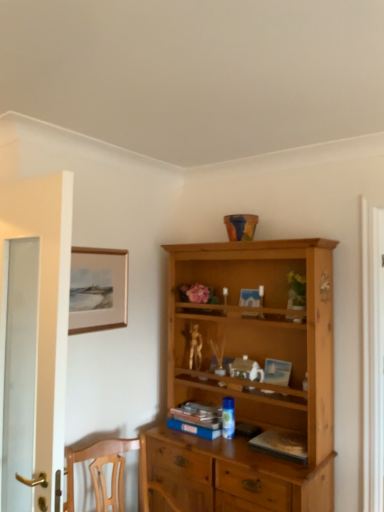
At what (x,y) coordinates should I click in order to perform the action: click on blue matte book at center, the first book positioned from the back. Please return your answer as a coordinate pair (x, y). The image size is (384, 512). Looking at the image, I should click on (196, 419).

Locate an element on the screen. matte gold picture frame at upper left is located at coordinates (100, 290).

At what (x,y) coordinates should I click in order to perform the action: click on white glass door at left. Please return your answer as a coordinate pair (x, y). The height and width of the screenshot is (512, 384). Looking at the image, I should click on (43, 306).

Is the depth of matte gold picture frame at upper left greater than that of gold metallic figurine at center?

That is False.

Consider the image. How far apart are matte gold picture frame at upper left and gold metallic figurine at center?

A distance of 63.82 centimeters exists between matte gold picture frame at upper left and gold metallic figurine at center.

Is matte gold picture frame at upper left at the right side of gold metallic figurine at center?

Incorrect, matte gold picture frame at upper left is not on the right side of gold metallic figurine at center.

From the picture: From the image's perspective, is matte gold picture frame at upper left located above or below gold metallic figurine at center?

From the image's perspective, matte gold picture frame at upper left appears above gold metallic figurine at center.

Which is in front, matte gold picture frame at upper left or white glass door at left?

white glass door at left.

Can you confirm if matte gold picture frame at upper left is shorter than white glass door at left?

Result: Yes.

Is matte gold picture frame at upper left wider or thinner than white glass door at left?

Clearly, matte gold picture frame at upper left has less width compared to white glass door at left.

From the image's perspective, which is below, matte gold picture frame at upper left or white glass door at left?

white glass door at left is shown below in the image.

In the image, is blue matte book at center, acting as the first book starting from the left, on the left side or the right side of hardcover book at center, the second book from the back?

blue matte book at center, acting as the first book starting from the left, is positioned on hardcover book at center, the second book from the back,'s left side.

From their relative heights in the image, would you say blue matte book at center, the first book positioned from the back, is taller or shorter than hardcover book at center, acting as the first book starting from the right?

blue matte book at center, the first book positioned from the back, is taller than hardcover book at center, acting as the first book starting from the right.

Can you see blue matte book at center, the first book positioned from the back, touching hardcover book at center, which is the 2th book from left to right?

No, blue matte book at center, the first book positioned from the back, is not in contact with hardcover book at center, which is the 2th book from left to right.

Can you tell me how much blue matte book at center, acting as the first book starting from the left, and hardcover book at center, the 1th book positioned from the front, differ in facing direction?

The angle between the facing direction of blue matte book at center, acting as the first book starting from the left, and the facing direction of hardcover book at center, the 1th book positioned from the front, is 8.95e-05 degrees.

Is white glass door at left positioned beyond the bounds of gold metallic figurine at center?

That's correct, white glass door at left is outside of gold metallic figurine at center.

Is white glass door at left at the left side of gold metallic figurine at center?

Yes, white glass door at left is to the left of gold metallic figurine at center.

Is white glass door at left wider than gold metallic figurine at center?

Yes, white glass door at left is wider than gold metallic figurine at center.

Based on the photo, is matte gold picture frame at upper left positioned with its back to blue matte book at center, acting as the first book starting from the left?

Result: matte gold picture frame at upper left does not have its back to blue matte book at center, acting as the first book starting from the left.

Does matte gold picture frame at upper left have a smaller size compared to blue matte book at center, the first book positioned from the back?

Yes.

Is matte gold picture frame at upper left to the right of blue matte book at center, acting as the second book starting from the right, from the viewer's perspective?

In fact, matte gold picture frame at upper left is to the left of blue matte book at center, acting as the second book starting from the right.

Considering the sizes of gold metallic figurine at center and white glass door at left in the image, is gold metallic figurine at center taller or shorter than white glass door at left?

In the image, gold metallic figurine at center appears to be shorter than white glass door at left.

Would you say gold metallic figurine at center is outside white glass door at left?

That's correct, gold metallic figurine at center is outside of white glass door at left.

From the image's perspective, which object appears higher, gold metallic figurine at center or white glass door at left?

white glass door at left.

Is gold metallic figurine at center far away from white glass door at left?

Indeed, gold metallic figurine at center is not near white glass door at left.

From the image's perspective, which object appears higher, white glass door at left or hardcover book at center, the 1th book positioned from the front?

white glass door at left is shown above in the image.

Is white glass door at left far from hardcover book at center, acting as the first book starting from the right?

Yes, white glass door at left and hardcover book at center, acting as the first book starting from the right, are located far from each other.

Between white glass door at left and hardcover book at center, which is the 2th book from left to right, which one is positioned behind?

Positioned behind is hardcover book at center, which is the 2th book from left to right.

Is white glass door at left not inside hardcover book at center, which is the 2th book from left to right?

Absolutely, white glass door at left is external to hardcover book at center, which is the 2th book from left to right.

Image resolution: width=384 pixels, height=512 pixels. I want to click on picture frame located above the gold metallic figurine at center (from the image's perspective), so click(x=100, y=290).

The width and height of the screenshot is (384, 512). I want to click on door that is on the left side of matte gold picture frame at upper left, so click(x=43, y=306).

Considering their positions, is hardcover book at center, the 1th book positioned from the front, positioned further to matte gold picture frame at upper left than white glass door at left?

hardcover book at center, the 1th book positioned from the front, is positioned further to the anchor matte gold picture frame at upper left.

When comparing their distances from gold metallic figurine at center, does blue matte book at center, acting as the first book starting from the left, or matte gold picture frame at upper left seem further?

matte gold picture frame at upper left is positioned further to the anchor gold metallic figurine at center.

When comparing their distances from blue matte book at center, acting as the second book starting from the right, does hardcover book at center, the second book from the back, or matte gold picture frame at upper left seem closer?

hardcover book at center, the second book from the back, is closer to blue matte book at center, acting as the second book starting from the right.

Estimate the real-world distances between objects in this image. Which object is closer to gold metallic figurine at center, hardcover book at center, which is the 2th book from left to right, or blue matte book at center, the first book positioned from the back?

Based on the image, blue matte book at center, the first book positioned from the back, appears to be nearer to gold metallic figurine at center.

Based on the photo, estimate the real-world distances between objects in this image. Which object is closer to gold metallic figurine at center, matte gold picture frame at upper left or white glass door at left?

matte gold picture frame at upper left is closer to gold metallic figurine at center.

When comparing their distances from matte gold picture frame at upper left, does gold metallic figurine at center or hardcover book at center, the second book from the back, seem closer?

gold metallic figurine at center lies closer to matte gold picture frame at upper left than the other object.

Which object lies further to the anchor point hardcover book at center, the 1th book positioned from the front, blue matte book at center, acting as the second book starting from the right, or white glass door at left?

white glass door at left is further to hardcover book at center, the 1th book positioned from the front.

From the image, which object appears to be nearer to blue matte book at center, the first book positioned from the back, gold metallic figurine at center or matte gold picture frame at upper left?

gold metallic figurine at center is closer to blue matte book at center, the first book positioned from the back.

At what (x,y) coordinates should I click in order to perform the action: click on toy that lies between matte gold picture frame at upper left and blue matte book at center, acting as the first book starting from the left, from top to bottom. Please return your answer as a coordinate pair (x, y). Looking at the image, I should click on (195, 348).

At what (x,y) coordinates should I click in order to perform the action: click on book situated between matte gold picture frame at upper left and hardcover book at center, acting as the first book starting from the right, from left to right. Please return your answer as a coordinate pair (x, y). The width and height of the screenshot is (384, 512). Looking at the image, I should click on (196, 419).

The width and height of the screenshot is (384, 512). I want to click on book located between hardcover book at center, which is the 2th book from left to right, and gold metallic figurine at center in the depth direction, so click(196, 419).

Identify the location of picture frame positioned between white glass door at left and blue matte book at center, acting as the second book starting from the right, from near to far. (100, 290).